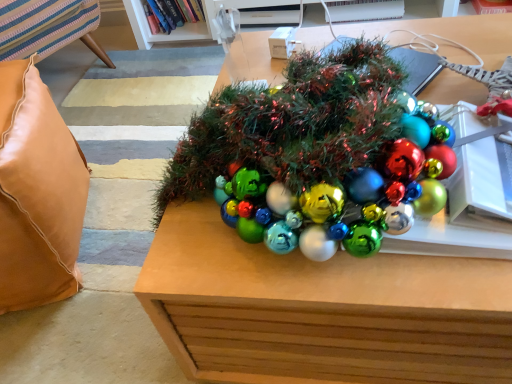
Question: Is metallic brown table at center, the second table in the top-to-bottom sequence, completely or partially inside hardcover book at upper center?

Choices:
 (A) no
 (B) yes

Answer: (A)

Question: Is hardcover book at upper center closer to camera compared to metallic brown table at center, positioned as the 1th table in bottom-to-top order?

Choices:
 (A) yes
 (B) no

Answer: (B)

Question: Does hardcover book at upper center appear on the left side of metallic brown table at center, the second table in the top-to-bottom sequence?

Choices:
 (A) no
 (B) yes

Answer: (B)

Question: From the image's perspective, is hardcover book at upper center over metallic brown table at center, positioned as the 1th table in bottom-to-top order?

Choices:
 (A) no
 (B) yes

Answer: (B)

Question: Does hardcover book at upper center have a lesser height compared to metallic brown table at center, positioned as the 1th table in bottom-to-top order?

Choices:
 (A) no
 (B) yes

Answer: (B)

Question: In terms of width, does leather cushion at left look wider or thinner when compared to hardcover book at upper center?

Choices:
 (A) thin
 (B) wide

Answer: (B)

Question: From a real-world perspective, is leather cushion at left above or below hardcover book at upper center?

Choices:
 (A) above
 (B) below

Answer: (A)

Question: Considering the positions of leather cushion at left and hardcover book at upper center in the image, is leather cushion at left bigger or smaller than hardcover book at upper center?

Choices:
 (A) small
 (B) big

Answer: (B)

Question: Which is correct: leather cushion at left is inside hardcover book at upper center, or outside of it?

Choices:
 (A) outside
 (B) inside

Answer: (A)

Question: From a real-world perspective, is hardcover book at upper center positioned above or below shiny green tinsel at center, arranged as the second table when ordered from the bottom?

Choices:
 (A) below
 (B) above

Answer: (A)

Question: Is hardcover book at upper center bigger or smaller than shiny green tinsel at center, placed as the 1th table when sorted from top to bottom?

Choices:
 (A) big
 (B) small

Answer: (B)

Question: Is hardcover book at upper center taller or shorter than shiny green tinsel at center, placed as the 1th table when sorted from top to bottom?

Choices:
 (A) tall
 (B) short

Answer: (A)

Question: From the image's perspective, is hardcover book at upper center positioned above or below shiny green tinsel at center, placed as the 1th table when sorted from top to bottom?

Choices:
 (A) above
 (B) below

Answer: (A)

Question: Is metallic brown table at center, positioned as the 1th table in bottom-to-top order, wider or thinner than leather cushion at left?

Choices:
 (A) thin
 (B) wide

Answer: (B)

Question: Does point (501, 307) appear closer or farther from the camera than point (42, 274)?

Choices:
 (A) closer
 (B) farther

Answer: (A)